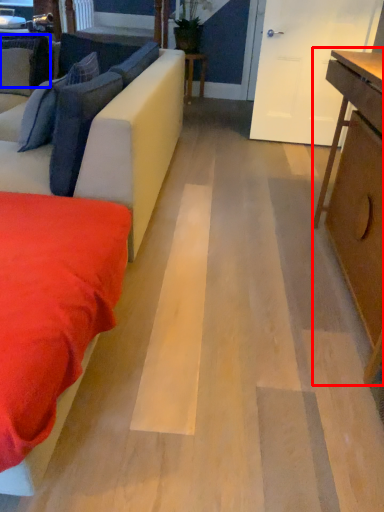
Question: Which object appears farthest to the camera in this image, table (highlighted by a red box) or pillow (highlighted by a blue box)?

Choices:
 (A) table
 (B) pillow

Answer: (B)